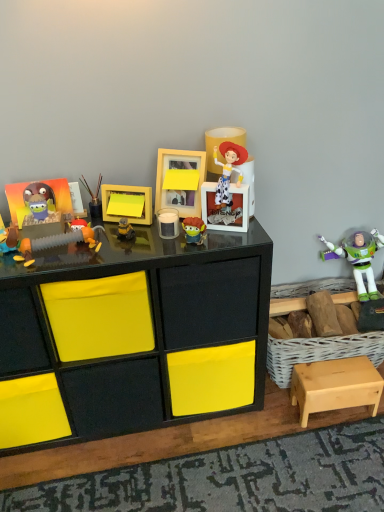
Question: Is matte orange toy at center-left, which ranks as the 5th toy in right-to-left order, positioned far away from plush toy at left, which appears as the 6th toy when viewed from the right?

Choices:
 (A) no
 (B) yes

Answer: (A)

Question: Considering the relative sizes of matte orange toy at center-left, which ranks as the 5th toy in right-to-left order, and plush toy at left, which appears as the 6th toy when viewed from the right, in the image provided, is matte orange toy at center-left, which ranks as the 5th toy in right-to-left order, thinner than plush toy at left, which appears as the 6th toy when viewed from the right,?

Choices:
 (A) yes
 (B) no

Answer: (A)

Question: Considering the relative sizes of matte orange toy at center-left, which is the third toy from left to right, and plush toy at left, which appears as the 6th toy when viewed from the right, in the image provided, is matte orange toy at center-left, which is the third toy from left to right, taller than plush toy at left, which appears as the 6th toy when viewed from the right,?

Choices:
 (A) yes
 (B) no

Answer: (B)

Question: From the image's perspective, is matte orange toy at center-left, which ranks as the 5th toy in right-to-left order, under plush toy at left, arranged as the second toy when viewed from the left?

Choices:
 (A) yes
 (B) no

Answer: (B)

Question: Is matte orange toy at center-left, which ranks as the 5th toy in right-to-left order, facing away from plush toy at left, which appears as the 6th toy when viewed from the right?

Choices:
 (A) no
 (B) yes

Answer: (A)

Question: Visually, is matte plastic toy at left, which is the first toy from left to right, positioned to the left or to the right of white plastic buzz lightyear figure at upper right, placed as the seventh toy when sorted from left to right?

Choices:
 (A) left
 (B) right

Answer: (A)

Question: Is matte plastic toy at left, the 7th toy positioned from the right, situated inside white plastic buzz lightyear figure at upper right, the first toy when ordered from right to left, or outside?

Choices:
 (A) inside
 (B) outside

Answer: (B)

Question: From their relative heights in the image, would you say matte plastic toy at left, which is the first toy from left to right, is taller or shorter than white plastic buzz lightyear figure at upper right, placed as the seventh toy when sorted from left to right?

Choices:
 (A) tall
 (B) short

Answer: (B)

Question: Does point (16, 229) appear closer or farther from the camera than point (322, 243)?

Choices:
 (A) closer
 (B) farther

Answer: (A)

Question: Considering the positions of matte orange toy at center-left, which is the third toy from left to right, and metallic paintbrushes at center, which is the fourth toy in right-to-left order, in the image, is matte orange toy at center-left, which is the third toy from left to right, wider or thinner than metallic paintbrushes at center, which is the fourth toy in right-to-left order,?

Choices:
 (A) thin
 (B) wide

Answer: (A)

Question: Is matte orange toy at center-left, which ranks as the 5th toy in right-to-left order, taller or shorter than metallic paintbrushes at center, which appears as the fourth toy when viewed from the left?

Choices:
 (A) tall
 (B) short

Answer: (B)

Question: Is matte orange toy at center-left, which ranks as the 5th toy in right-to-left order, inside or outside of metallic paintbrushes at center, which appears as the fourth toy when viewed from the left?

Choices:
 (A) outside
 (B) inside

Answer: (A)

Question: Is matte orange toy at center-left, which is the third toy from left to right, in front of or behind metallic paintbrushes at center, which appears as the fourth toy when viewed from the left, in the image?

Choices:
 (A) behind
 (B) front

Answer: (B)

Question: Is metallic paintbrushes at center, which appears as the fourth toy when viewed from the left, spatially inside black glossy desk at center, or outside of it?

Choices:
 (A) outside
 (B) inside

Answer: (A)

Question: Looking at the image, does metallic paintbrushes at center, which appears as the fourth toy when viewed from the left, seem bigger or smaller compared to black glossy desk at center?

Choices:
 (A) big
 (B) small

Answer: (B)